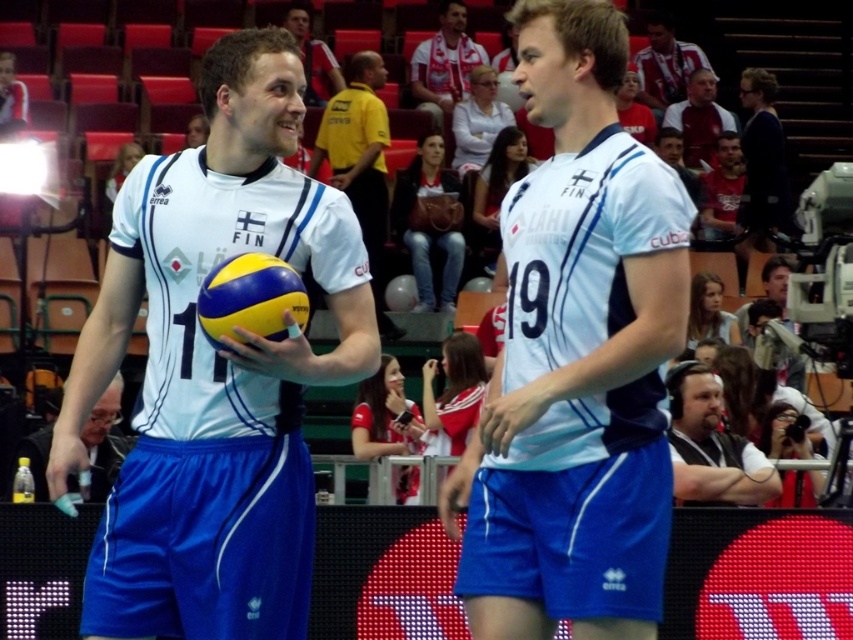
In the volleyball match scene, there are two players from Finland wearing white jerseys with blue accents and blue shorts. One is holding a yellow and blue volleyball and has the number 11 on their jersey, while the other has the number 19. There is also a point marked at coordinates (215,371). Which player is wearing the jersey located at the center of the image?

The point at (215,371) corresponds to the white matte vinyl jersey at center, so the player wearing the jersey located at the center of the image is the one with the white matte vinyl jersey at center.